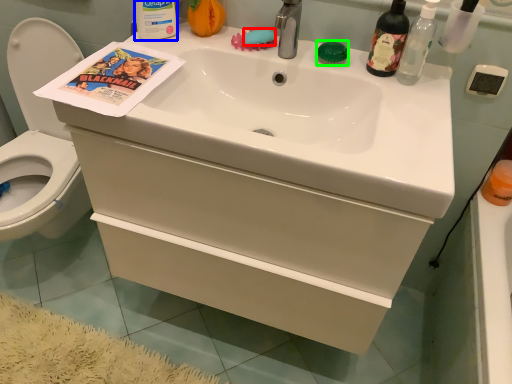
Question: Which object is positioned farthest from soap (highlighted by a red box)? Select from bottle (highlighted by a blue box) and soap (highlighted by a green box).

Choices:
 (A) bottle
 (B) soap

Answer: (A)